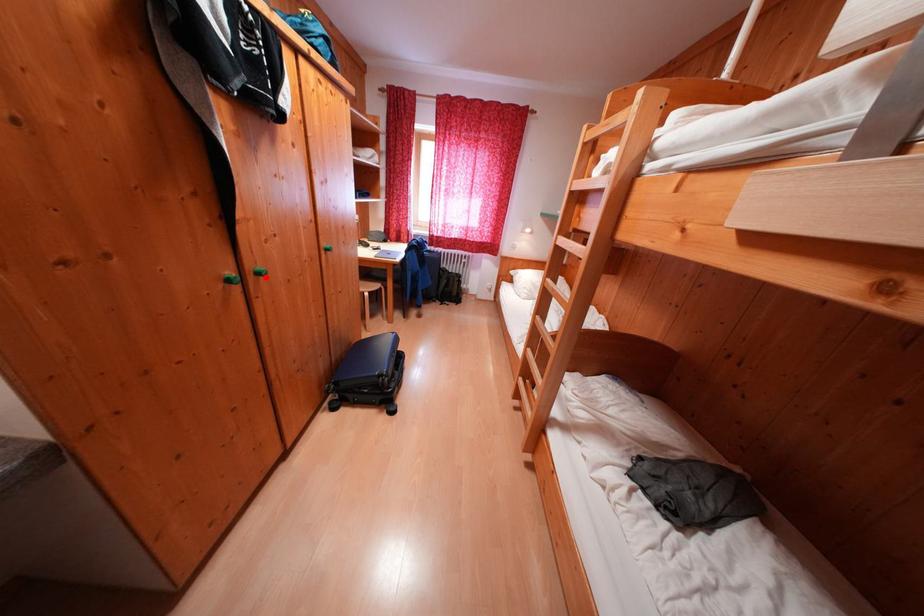
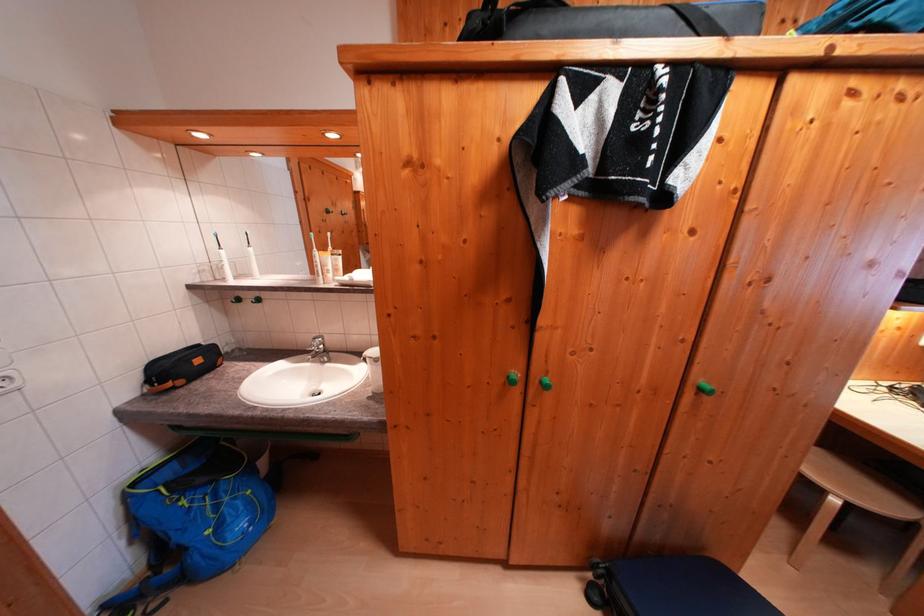
Question: I am providing you with two images of the same scene from different viewpoints. In image1, a red point is highlighted. Considering the same 3D point in image2, which of the following is correct?

Choices:
 (A) It is closer
 (B) It is farther

Answer: (B)